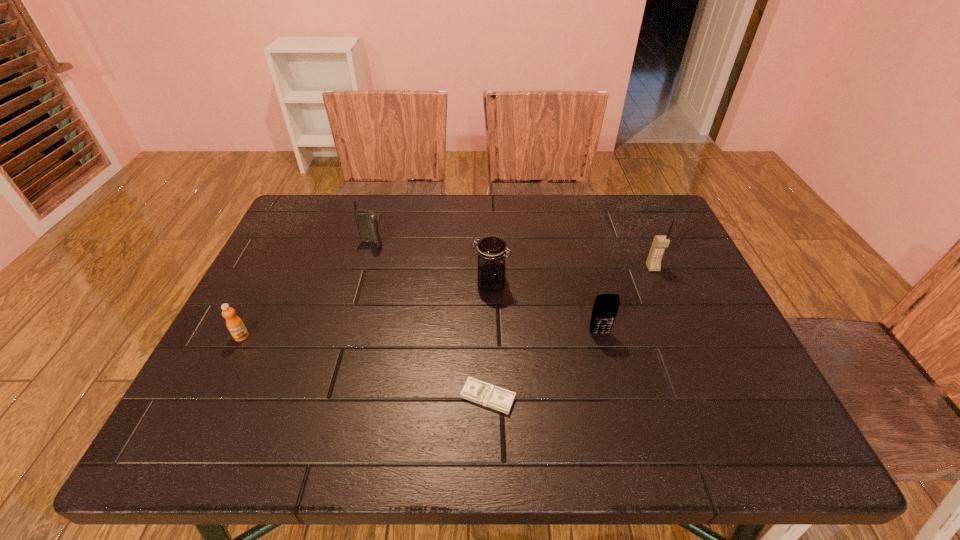
Identify the location of money. point(474,390).

Identify the location of free region located on the front of the fifth nearest object, where the keypad is located. (680, 330).

Locate an element on the screen. free spot located on the keyboard of the leftmost cellular telephone is located at coordinates (339, 361).

Locate an element on the screen. The image size is (960, 540). vacant region located 0.210m on the lid of the fourth nearest object is located at coordinates (391, 283).

Locate an element on the screen. The height and width of the screenshot is (540, 960). vacant space located 0.110m on the lid of the fourth nearest object is located at coordinates (430, 283).

Find the location of a particular element. The height and width of the screenshot is (540, 960). free space located 0.130m on the lid of the fourth nearest object is located at coordinates (422, 283).

The image size is (960, 540). Identify the location of blank space located 0.270m on the screen of the second cellular telephone from left to right. pyautogui.click(x=630, y=453).

Image resolution: width=960 pixels, height=540 pixels. I want to click on vacant space located 0.120m on the front label of the leftmost object, so click(215, 388).

Image resolution: width=960 pixels, height=540 pixels. Identify the location of blank area located on the back of the money. (488, 353).

The width and height of the screenshot is (960, 540). Find the location of `object positioned at the far edge`. object positioned at the far edge is located at coordinates (366, 220).